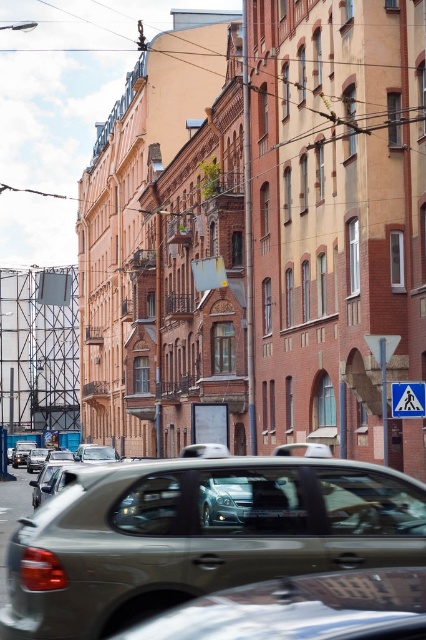
Question: From the image, what is the correct spatial relationship of metallic silver car at center in relation to blue plastic pedestrian crossing sign at center?

Choices:
 (A) left
 (B) right

Answer: (A)

Question: Does metallic silver car at center have a lesser width compared to blue plastic pedestrian crossing sign at center?

Choices:
 (A) yes
 (B) no

Answer: (B)

Question: Which of the following is the closest to the observer?

Choices:
 (A) (106, 627)
 (B) (400, 413)

Answer: (A)

Question: Does metallic silver car at center appear on the left side of blue plastic pedestrian crossing sign at center?

Choices:
 (A) no
 (B) yes

Answer: (B)